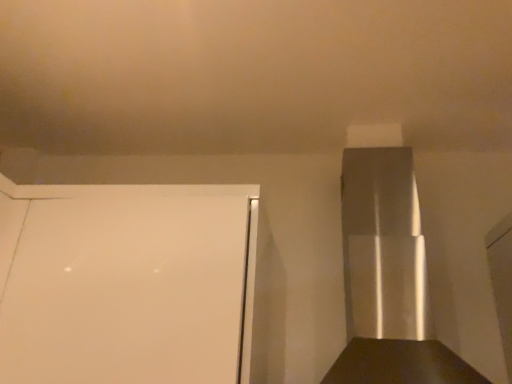
Describe the element at coordinates (126, 283) in the screenshot. I see `white glossy refrigerator at left` at that location.

Where is `white glossy refrigerator at left`? This screenshot has height=384, width=512. white glossy refrigerator at left is located at coordinates (126, 283).

Image resolution: width=512 pixels, height=384 pixels. I want to click on white glossy refrigerator at left, so click(126, 283).